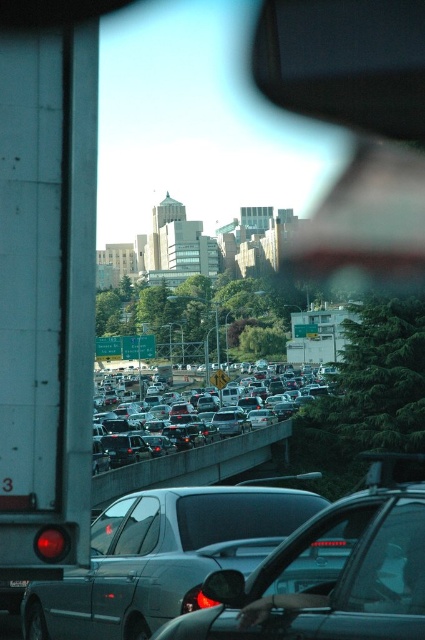
You are driving and looking through the windshield. You see two points marked on the road ahead. The first point is at coordinates point (74, 164) and the second is at point (121, 579). Which point is closer to your vehicle?

Point (74, 164) is closer to your vehicle because it is in front of point (121, 579).

You are a driver checking your mirrors before changing lanes. You notice the glossy plastic rearview mirror at upper right and the silver metallic sedan at center. Which object appears taller in your view?

The glossy plastic rearview mirror at upper right appears taller than the silver metallic sedan at center in the driver view.